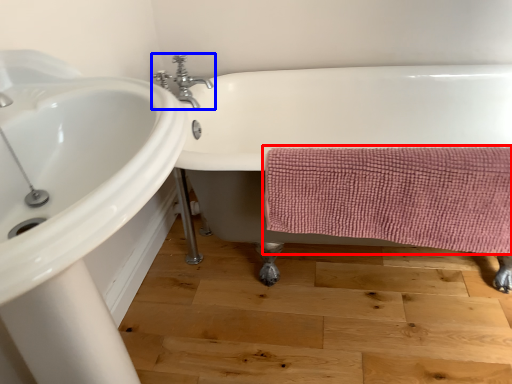
Question: Which object is closer to the camera taking this photo, bath towel (highlighted by a red box) or tap (highlighted by a blue box)?

Choices:
 (A) bath towel
 (B) tap

Answer: (A)